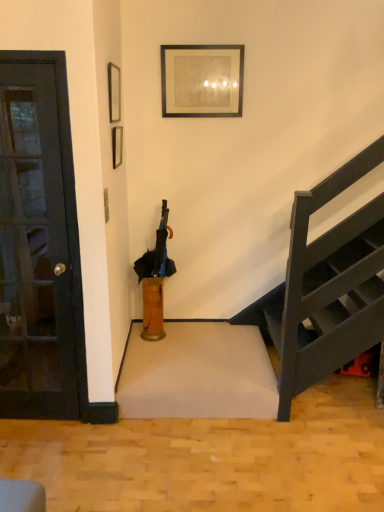
Question: Does black glass door at left have a lesser width compared to black matte picture frame at upper center, the second picture frame positioned from the left?

Choices:
 (A) yes
 (B) no

Answer: (B)

Question: Does black glass door at left have a greater width compared to black matte picture frame at upper center, which is the second picture frame from front to back?

Choices:
 (A) no
 (B) yes

Answer: (B)

Question: From the image's perspective, is black glass door at left under black matte picture frame at upper center, the first picture frame positioned from the back?

Choices:
 (A) no
 (B) yes

Answer: (B)

Question: Is black glass door at left taller than black matte picture frame at upper center, which is the second picture frame from front to back?

Choices:
 (A) yes
 (B) no

Answer: (A)

Question: Is black glass door at left with black matte picture frame at upper center, which is the second picture frame from front to back?

Choices:
 (A) yes
 (B) no

Answer: (B)

Question: Is black matte picture frame at upper center, which appears as the first picture frame when viewed from the right, spatially inside black glass door at left, or outside of it?

Choices:
 (A) inside
 (B) outside

Answer: (B)

Question: Is black matte picture frame at upper center, the first picture frame positioned from the back, in front of or behind black glass door at left in the image?

Choices:
 (A) front
 (B) behind

Answer: (B)

Question: In terms of height, does black matte picture frame at upper center, the second picture frame positioned from the left, look taller or shorter compared to black glass door at left?

Choices:
 (A) tall
 (B) short

Answer: (B)

Question: Is black matte picture frame at upper center, which is the second picture frame from front to back, wider or thinner than black glass door at left?

Choices:
 (A) wide
 (B) thin

Answer: (B)

Question: Is matte black picture frame at upper left, the second picture frame viewed from the right, spatially inside black matte umbrella at center, or outside of it?

Choices:
 (A) outside
 (B) inside

Answer: (A)

Question: From a real-world perspective, relative to black matte umbrella at center, is matte black picture frame at upper left, which appears as the second picture frame when viewed from the back, vertically above or below?

Choices:
 (A) above
 (B) below

Answer: (A)

Question: Based on their sizes in the image, would you say matte black picture frame at upper left, the second picture frame viewed from the right, is bigger or smaller than black matte umbrella at center?

Choices:
 (A) big
 (B) small

Answer: (B)

Question: In terms of height, does matte black picture frame at upper left, the second picture frame viewed from the right, look taller or shorter compared to black matte umbrella at center?

Choices:
 (A) tall
 (B) short

Answer: (B)

Question: Which is correct: translucent glass vase at center is inside black matte umbrella at center, or outside of it?

Choices:
 (A) inside
 (B) outside

Answer: (B)

Question: From a real-world perspective, is translucent glass vase at center positioned above or below black matte umbrella at center?

Choices:
 (A) below
 (B) above

Answer: (A)